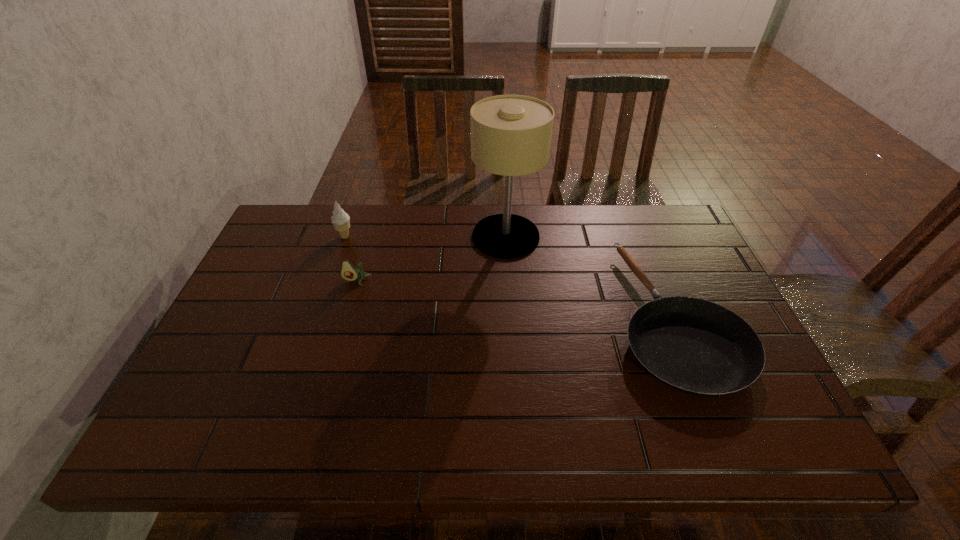
Locate an element on the screen. The height and width of the screenshot is (540, 960). free location that satisfies the following two spatial constraints: 1. on the front-facing side of the second object from right to left; 2. on the right side of the leftmost object is located at coordinates (345, 237).

Where is `vacant region that satisfies the following two spatial constraints: 1. on the back side of the rightmost object; 2. on the front-facing side of the third shortest object`? Image resolution: width=960 pixels, height=540 pixels. vacant region that satisfies the following two spatial constraints: 1. on the back side of the rightmost object; 2. on the front-facing side of the third shortest object is located at coordinates (640, 237).

You are a GUI agent. You are given a task and a screenshot of the screen. Output one action in this format:
    pyautogui.click(x=<x>, y=<y>)
    Task: Click on the free spot that satisfies the following two spatial constraints: 1. on the front-facing side of the third shortest object; 2. on the right side of the rightmost object
    This screenshot has height=540, width=960.
    Given the screenshot: What is the action you would take?
    pyautogui.click(x=317, y=317)